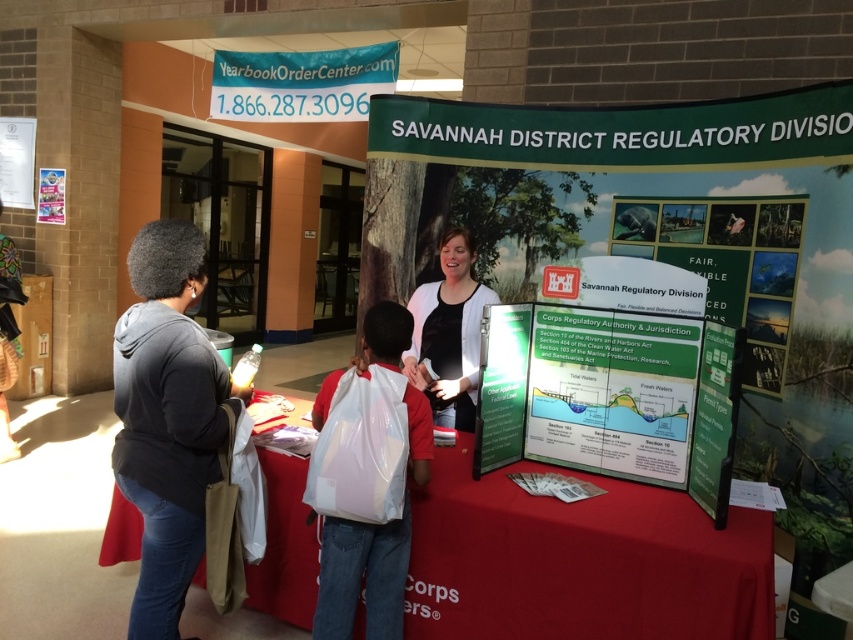
You are a visitor at the Savannah District Regulatory Division booth. You notice two white items at the center of the booth. Which item is positioned lower down between the white plastic bag at center and the white paper poster at center?

The white plastic bag at center is located below the white paper poster at center, so it is positioned lower down.

You are a visitor at the Savannah District Regulatory Division booth. You see a white plastic bag at center and a white paper poster at center. Which object is closer to you?

The white plastic bag at center is closer to you because it is in front of the white paper poster at center.

You are a visitor at the Savannah District Regulatory Division booth. You see the green matte poster at center and the white paper at upper left. Which object is located to the right of the other?

The green matte poster at center is positioned on the right side of white paper at upper left.